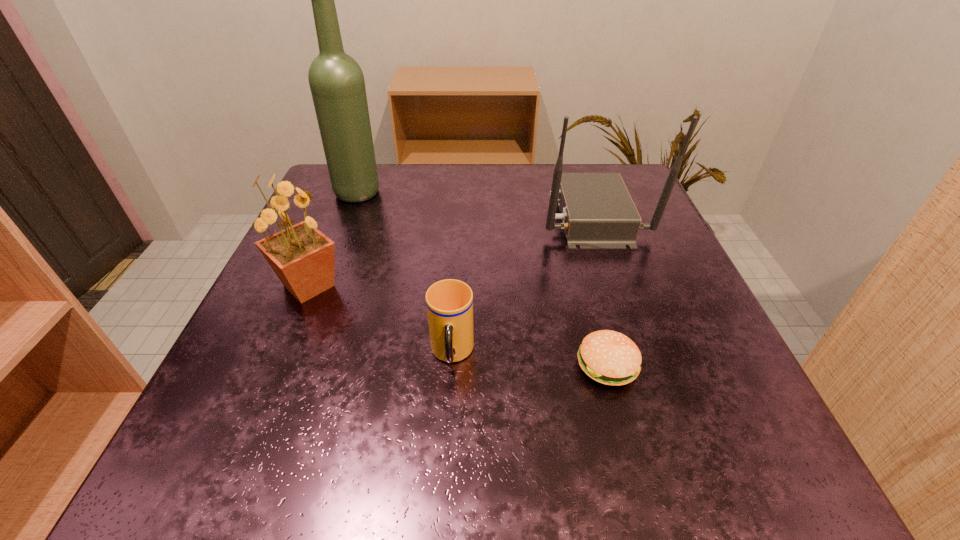
You are a GUI agent. You are given a task and a screenshot of the screen. Output one action in this format:
    pyautogui.click(x=<x>, y=<y>)
    Task: Click on the free region located 0.310m at the front of the third nearest object with flowers visible
    This screenshot has height=540, width=960.
    Given the screenshot: What is the action you would take?
    pyautogui.click(x=520, y=286)

The height and width of the screenshot is (540, 960). What are the coordinates of `free space located 0.100m on the side of the third object from left to right with the handle` in the screenshot? It's located at (446, 446).

Find the location of a particular element. free location located on the left of the shortest object is located at coordinates (415, 365).

The width and height of the screenshot is (960, 540). Find the location of `wine bottle situated at the far edge`. wine bottle situated at the far edge is located at coordinates (336, 81).

Locate an element on the screen. The width and height of the screenshot is (960, 540). router at the far edge is located at coordinates (597, 212).

I want to click on wine bottle present at the left edge, so click(336, 81).

Locate an element on the screen. This screenshot has width=960, height=540. sunflower located at the left edge is located at coordinates (302, 257).

You are a GUI agent. You are given a task and a screenshot of the screen. Output one action in this format:
    pyautogui.click(x=<x>, y=<y>)
    Task: Click on the router at the right edge
    
    Given the screenshot: What is the action you would take?
    pyautogui.click(x=597, y=212)

The height and width of the screenshot is (540, 960). Find the location of `patty that is positioned at the right edge`. patty that is positioned at the right edge is located at coordinates (611, 358).

Where is `object that is at the far left corner`? object that is at the far left corner is located at coordinates pos(336,81).